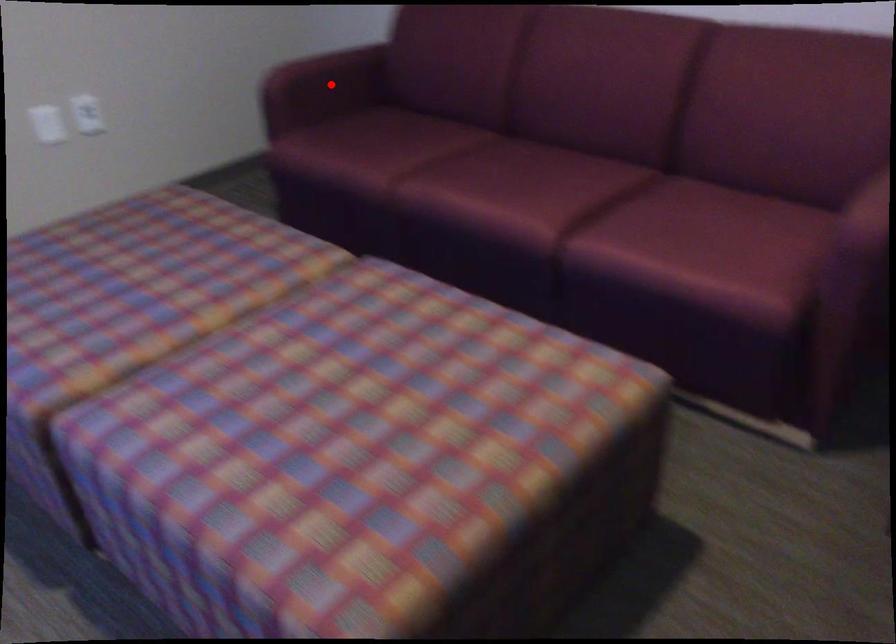
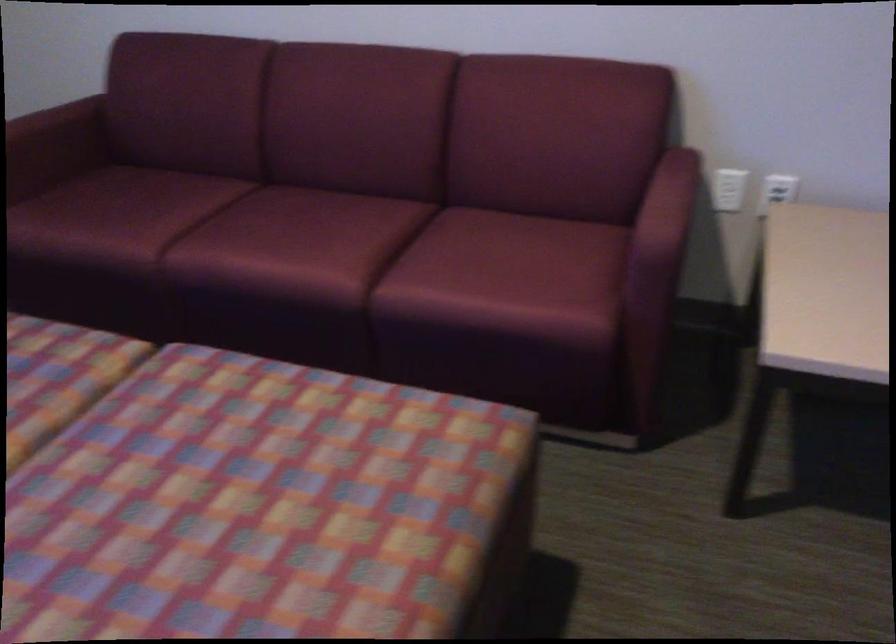
Locate, in the second image, the point that corresponds to the highlighted location in the first image.

(55, 147)